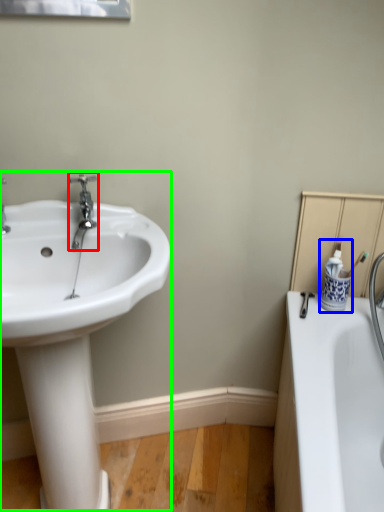
Question: Which is nearer to the tap (highlighted by a red box)? toiletry (highlighted by a blue box) or sink (highlighted by a green box).

Choices:
 (A) toiletry
 (B) sink

Answer: (B)